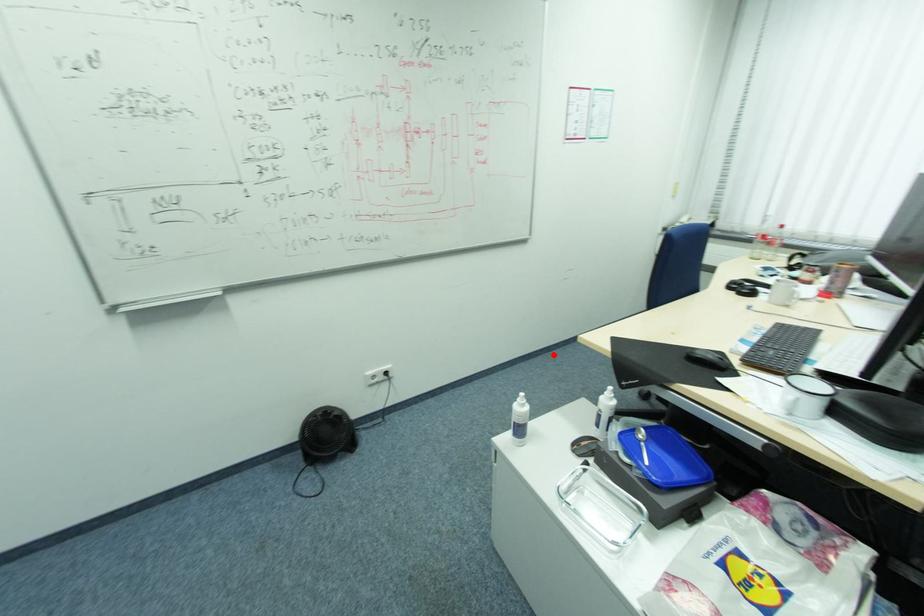
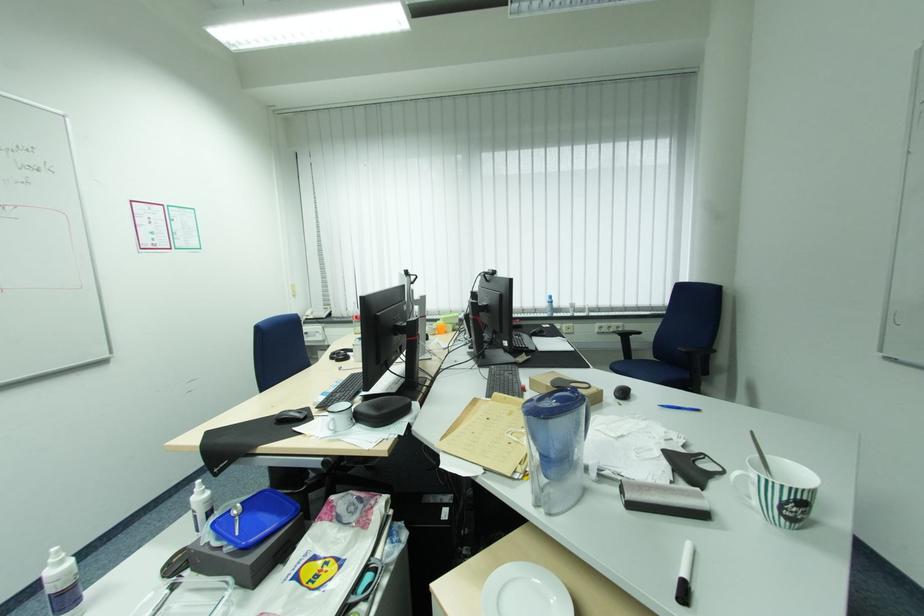
Question: I am providing you with two images of the same scene from different viewpoints. In image1, a red point is highlighted. Considering the same 3D point in image2, which of the following is correct?

Choices:
 (A) It is closer
 (B) It is farther

Answer: (A)